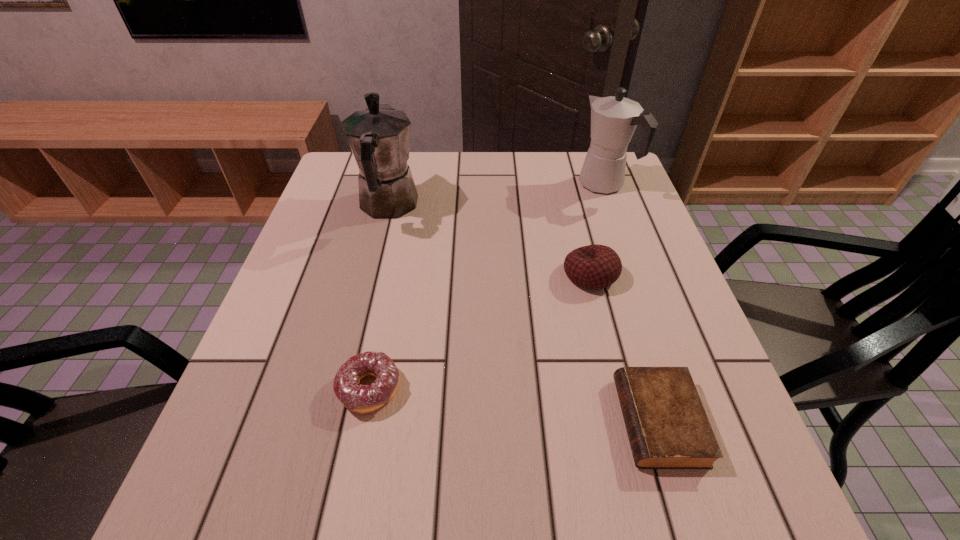
Identify the location of vacant region that satisfies the following two spatial constraints: 1. on the pouring side of the left coffeepot; 2. on the right side of the right coffeepot. The width and height of the screenshot is (960, 540). (394, 185).

The image size is (960, 540). What are the coordinates of `vacant area in the image that satisfies the following two spatial constraints: 1. on the pouring side of the right coffeepot; 2. on the right side of the left coffeepot` in the screenshot? It's located at (394, 185).

Where is `vacant region that satisfies the following two spatial constraints: 1. on the pouring side of the left coffeepot; 2. on the right side of the right coffeepot`? Image resolution: width=960 pixels, height=540 pixels. vacant region that satisfies the following two spatial constraints: 1. on the pouring side of the left coffeepot; 2. on the right side of the right coffeepot is located at coordinates (394, 185).